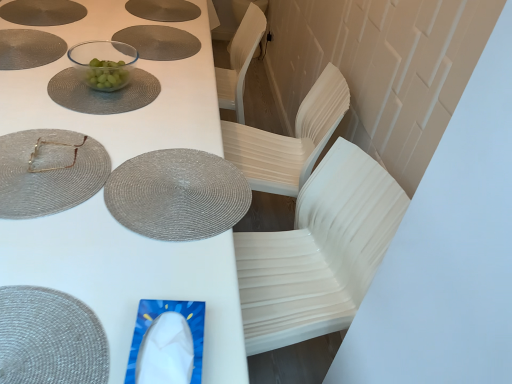
Locate an element on the screen. free point below matte gray placemat at upper center, which is the 1th platter from right to left (from a real-world perspective) is located at coordinates (164, 5).